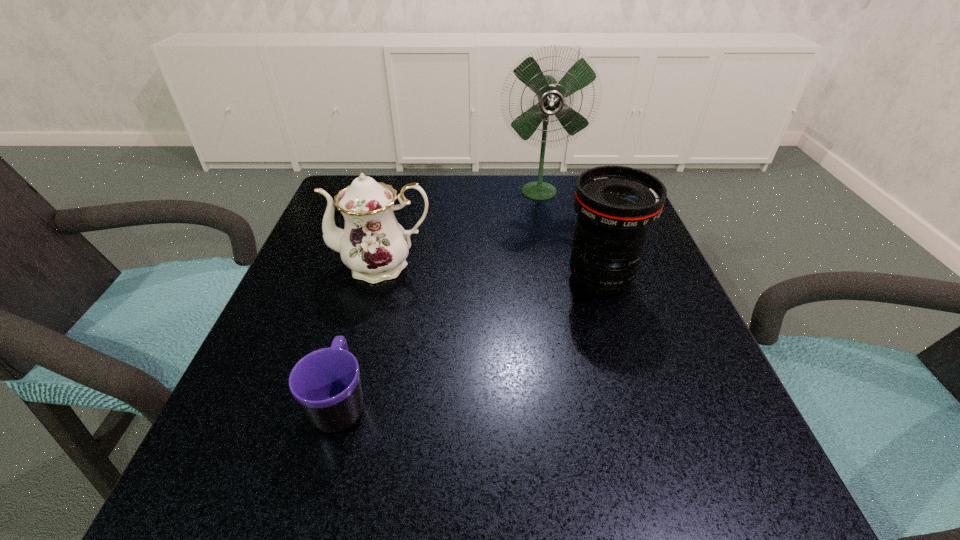
Locate an element on the screen. This screenshot has height=540, width=960. vacant space situated 0.300m with the handle on the side of the mug is located at coordinates (382, 251).

This screenshot has width=960, height=540. What are the coordinates of `vacant space located 0.330m with the handle on the side of the mug` in the screenshot? It's located at (385, 242).

Image resolution: width=960 pixels, height=540 pixels. I want to click on object that is at the far edge, so click(551, 94).

This screenshot has height=540, width=960. In order to click on chinaware that is at the left edge in this screenshot , I will do `click(373, 244)`.

This screenshot has width=960, height=540. In order to click on mug situated at the left edge in this screenshot , I will do `click(326, 383)`.

Locate an element on the screen. The width and height of the screenshot is (960, 540). fan that is at the right edge is located at coordinates (551, 94).

Where is `telephoto lens present at the right edge`? The image size is (960, 540). telephoto lens present at the right edge is located at coordinates (616, 205).

Identify the location of object that is positioned at the far right corner. (551, 94).

Where is `blank area at the far edge`? This screenshot has width=960, height=540. blank area at the far edge is located at coordinates (438, 184).

In the image, there is a desktop. Where is `vacant space at the near edge`? vacant space at the near edge is located at coordinates (341, 511).